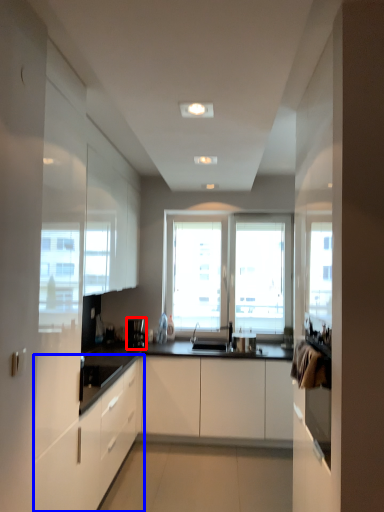
Question: Among these objects, which one is farthest to the camera, coffee machine (highlighted by a red box) or cabinetry (highlighted by a blue box)?

Choices:
 (A) coffee machine
 (B) cabinetry

Answer: (A)